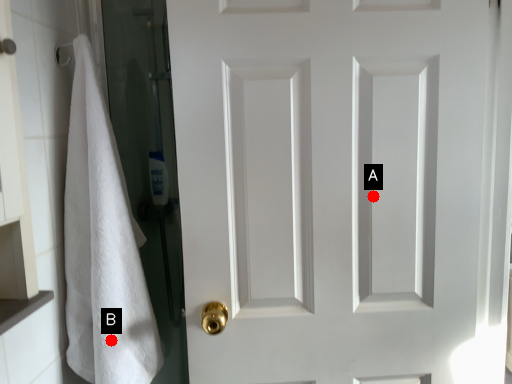
Question: Two points are circled on the image, labeled by A and B beside each circle. Which of the following is the farthest from the observer?

Choices:
 (A) A is further
 (B) B is further

Answer: (A)